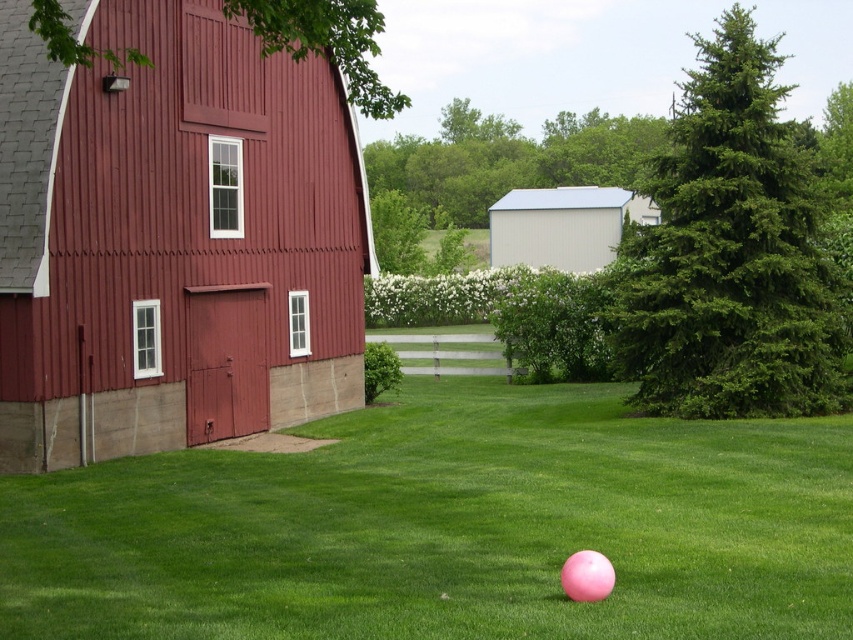
Question: Which object appears farthest from the camera in this image?

Choices:
 (A) white matte shed at center
 (B) green grass at center

Answer: (A)

Question: Can you confirm if green grass at center is positioned to the left of smooth red barn at center?

Choices:
 (A) no
 (B) yes

Answer: (A)

Question: Can you confirm if smooth red barn at center is positioned below white matte shed at center?

Choices:
 (A) no
 (B) yes

Answer: (B)

Question: Which of the following is the closest to the observer?

Choices:
 (A) green grass at center
 (B) white matte shed at center
 (C) smooth red barn at center
 (D) pink rubber ball at lower center

Answer: (A)

Question: Can you confirm if green grass at center is bigger than smooth red barn at center?

Choices:
 (A) yes
 (B) no

Answer: (B)

Question: Which point is farther to the camera?

Choices:
 (A) smooth red barn at center
 (B) white matte shed at center

Answer: (B)